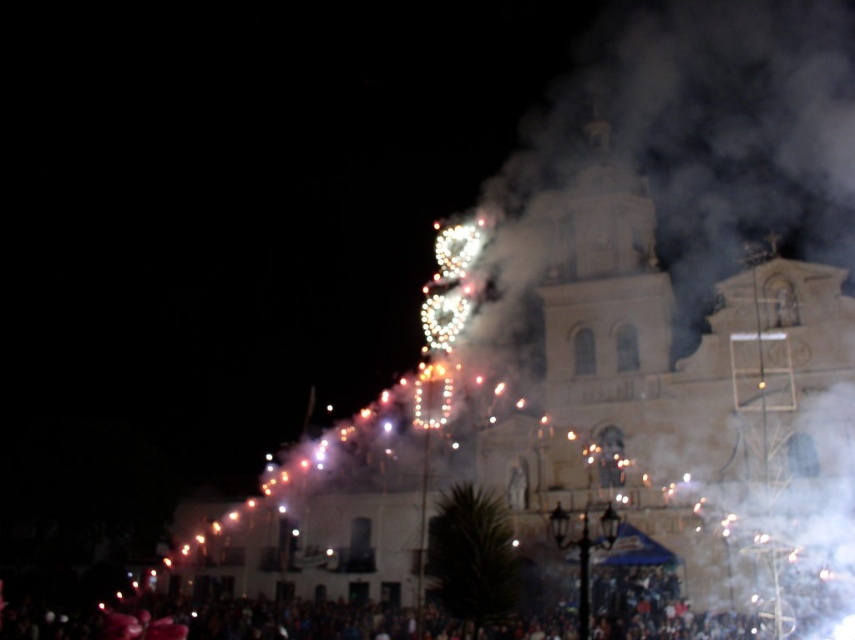
Does white stone church at center appear over dark clothing crowd at lower center?

Yes, white stone church at center is above dark clothing crowd at lower center.

Which is more to the right, white stone church at center or dark clothing crowd at lower center?

From the viewer's perspective, white stone church at center appears more on the right side.

Is point (818, 291) farther from camera compared to point (237, 609)?

No, (818, 291) is closer to viewer.

Where is `white stone church at center`? white stone church at center is located at coordinates (579, 428).